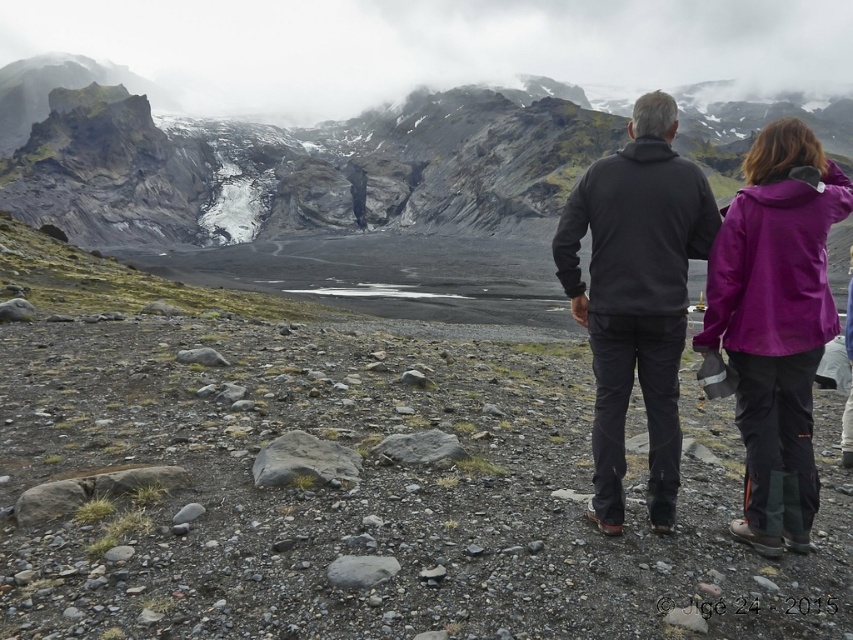
Does rugged rock mountain at upper center have a greater width compared to dark gray fleece jacket at center?

Indeed, rugged rock mountain at upper center has a greater width compared to dark gray fleece jacket at center.

Is rugged rock mountain at upper center above dark gray fleece jacket at center?

Indeed, rugged rock mountain at upper center is positioned over dark gray fleece jacket at center.

Looking at this image, who is more forward, (592, 128) or (602, 177)?

Point (602, 177)

Where is `rugged rock mountain at upper center`? Image resolution: width=853 pixels, height=640 pixels. rugged rock mountain at upper center is located at coordinates (285, 161).

Does point (804, 529) come closer to viewer compared to point (784, 262)?

Yes, it is in front of point (784, 262).

Who is positioned more to the right, dark gray fleece jacket at center or purple waterproof jacket at upper right?

From the viewer's perspective, purple waterproof jacket at upper right appears more on the right side.

Does point (764, 232) come farther from viewer compared to point (799, 164)?

No, it is not.

Where is `dark gray fleece jacket at center`? The width and height of the screenshot is (853, 640). dark gray fleece jacket at center is located at coordinates (712, 298).

Which is more to the left, rugged rock mountain at upper center or purple waterproof jacket at upper right?

From the viewer's perspective, purple waterproof jacket at upper right appears more on the left side.

This screenshot has height=640, width=853. What do you see at coordinates (285, 161) in the screenshot? I see `rugged rock mountain at upper center` at bounding box center [285, 161].

Locate an element on the screen. The image size is (853, 640). rugged rock mountain at upper center is located at coordinates (285, 161).